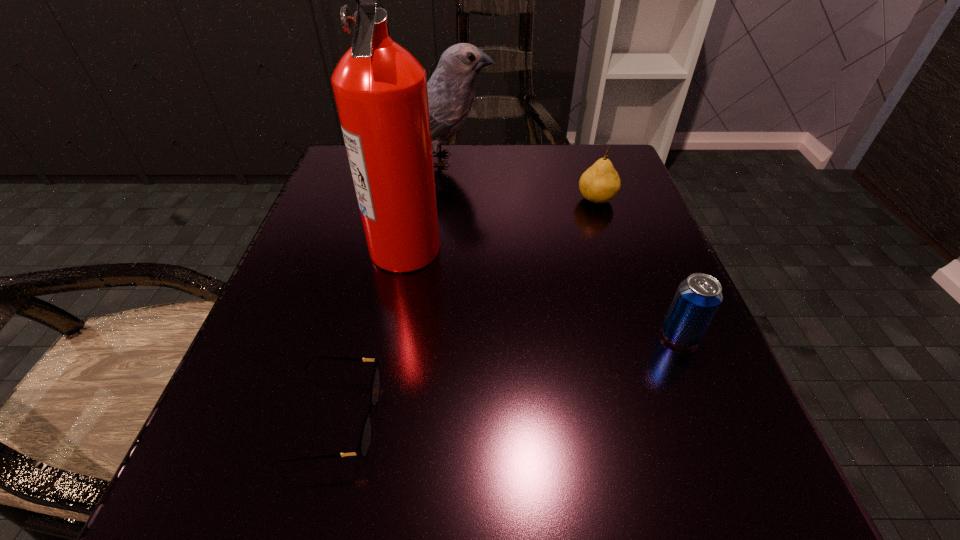
Where is `free region located on the back of the pear`? free region located on the back of the pear is located at coordinates (586, 166).

At what (x,y) coordinates should I click in order to perform the action: click on vacant area situated on the back of the beer can. Please return your answer as a coordinate pair (x, y). Looking at the image, I should click on (662, 292).

Image resolution: width=960 pixels, height=540 pixels. Find the location of `free spot located 0.250m on the front-facing side of the spectacles`. free spot located 0.250m on the front-facing side of the spectacles is located at coordinates (578, 419).

I want to click on parrot that is positioned at the far edge, so 451,90.

Locate an element on the screen. pear situated at the far edge is located at coordinates (600, 183).

Where is `object at the near edge`? object at the near edge is located at coordinates (362, 448).

Locate an element on the screen. The height and width of the screenshot is (540, 960). fire extinguisher positioned at the left edge is located at coordinates (380, 89).

The image size is (960, 540). In order to click on parrot that is at the left edge in this screenshot , I will do `click(451, 90)`.

Locate an element on the screen. spectacles at the left edge is located at coordinates (362, 448).

You are a GUI agent. You are given a task and a screenshot of the screen. Output one action in this format:
    pyautogui.click(x=<x>, y=<y>)
    Task: Click on the pear situated at the right edge
    This screenshot has width=960, height=540.
    Given the screenshot: What is the action you would take?
    pyautogui.click(x=600, y=183)